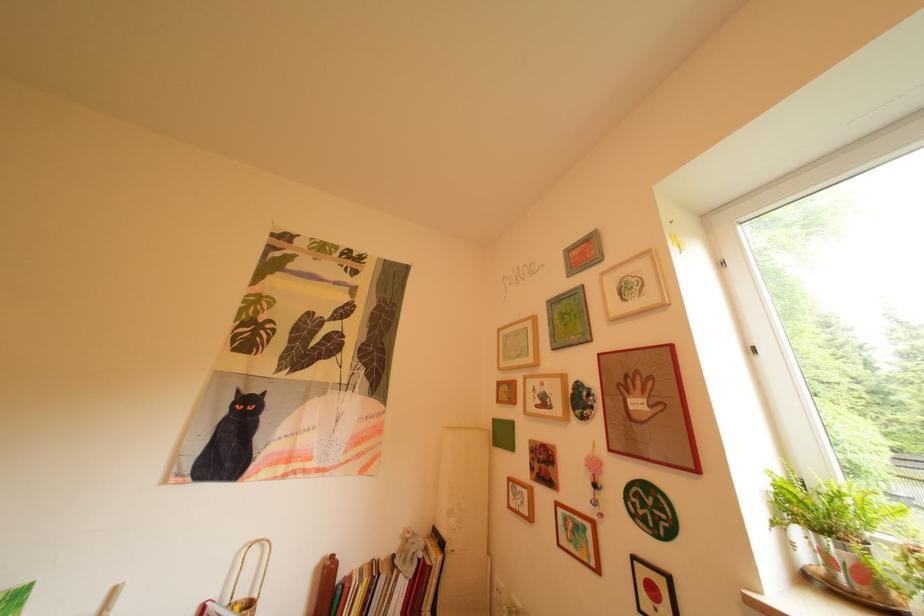
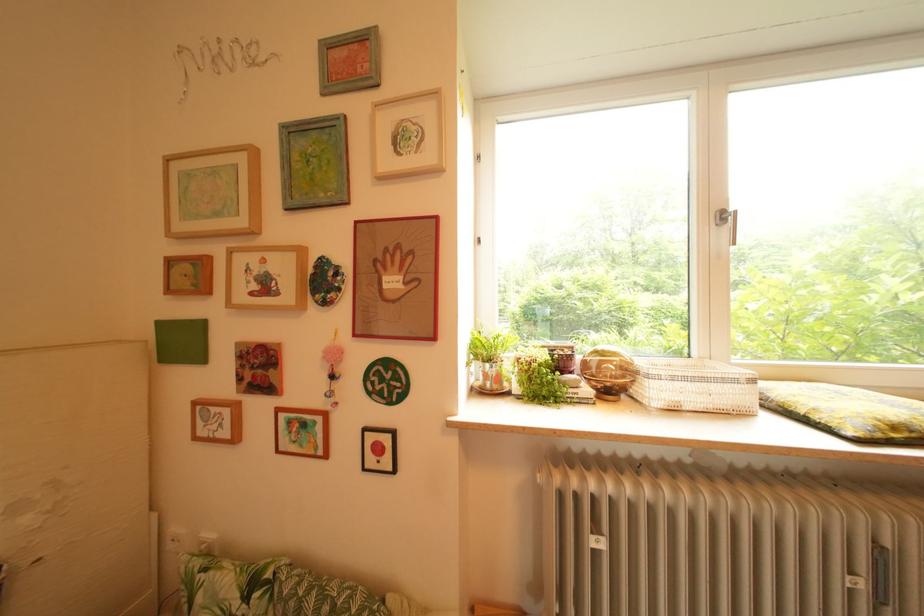
Question: The camera is either moving clockwise (left) or counter-clockwise (right) around the object. The first image is from the beginning of the video and the second image is from the end. Is the camera moving left or right when shooting the video?

Choices:
 (A) Left
 (B) Right

Answer: (A)